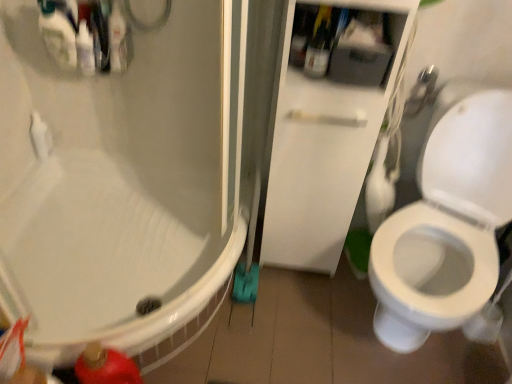
Question: Is translucent plastic bottles at upper left at the back of brushed metal showerhead at upper right?

Choices:
 (A) no
 (B) yes

Answer: (A)

Question: Is brushed metal showerhead at upper right oriented towards translucent plastic bottles at upper left?

Choices:
 (A) yes
 (B) no

Answer: (B)

Question: Can you confirm if brushed metal showerhead at upper right is taller than translucent plastic bottles at upper left?

Choices:
 (A) yes
 (B) no

Answer: (A)

Question: From a real-world perspective, is brushed metal showerhead at upper right physically below translucent plastic bottles at upper left?

Choices:
 (A) no
 (B) yes

Answer: (B)

Question: Can we say brushed metal showerhead at upper right lies outside translucent plastic bottles at upper left?

Choices:
 (A) yes
 (B) no

Answer: (A)

Question: Does brushed metal showerhead at upper right touch translucent plastic bottles at upper left?

Choices:
 (A) yes
 (B) no

Answer: (B)

Question: Does white glossy cabinet at center have a greater height compared to translucent plastic bottle at upper center?

Choices:
 (A) no
 (B) yes

Answer: (B)

Question: Is the depth of white glossy cabinet at center greater than that of translucent plastic bottle at upper center?

Choices:
 (A) no
 (B) yes

Answer: (A)

Question: Does white glossy cabinet at center have a greater width compared to translucent plastic bottle at upper center?

Choices:
 (A) yes
 (B) no

Answer: (A)

Question: Is translucent plastic bottle at upper center surrounded by white glossy cabinet at center?

Choices:
 (A) yes
 (B) no

Answer: (A)

Question: Is white glossy cabinet at center turned away from translucent plastic bottle at upper center?

Choices:
 (A) no
 (B) yes

Answer: (B)

Question: Is white glossy cabinet at center at the left side of translucent plastic bottle at upper center?

Choices:
 (A) no
 (B) yes

Answer: (A)

Question: Could you tell me if brushed metal showerhead at upper right is turned towards translucent plastic bottle at upper center?

Choices:
 (A) no
 (B) yes

Answer: (A)